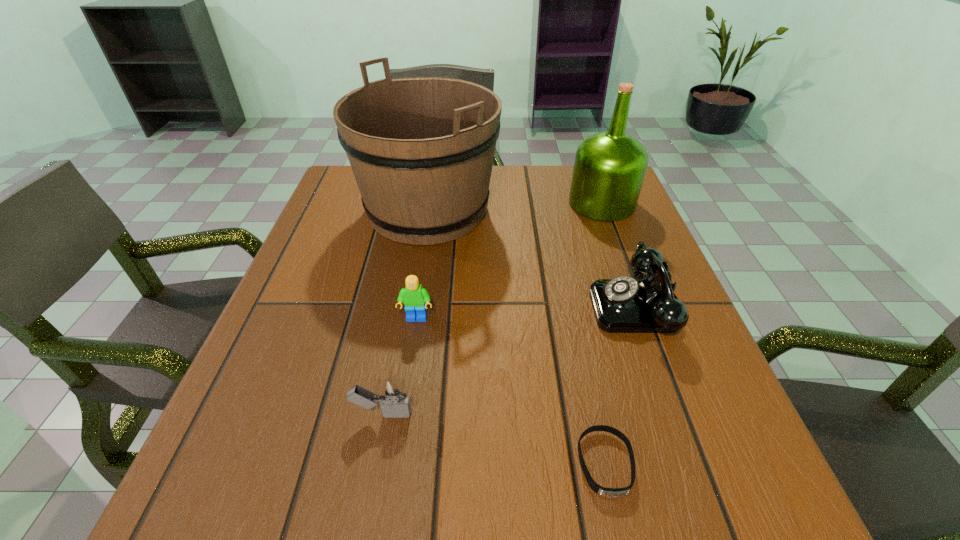
Find the location of `vacant position in the image that satisfies the following two spatial constraints: 1. on the dial of the telephone; 2. on the face of the Lego`. vacant position in the image that satisfies the following two spatial constraints: 1. on the dial of the telephone; 2. on the face of the Lego is located at coordinates (642, 319).

Find the location of a particular element. Image resolution: width=960 pixels, height=540 pixels. vacant space that satisfies the following two spatial constraints: 1. on the dial of the telephone; 2. on the display of the shortest object is located at coordinates (695, 464).

This screenshot has height=540, width=960. I want to click on vacant space that satisfies the following two spatial constraints: 1. on the dial of the telephone; 2. on the face of the Lego, so click(642, 319).

Where is `free region that satisfies the following two spatial constraints: 1. on the back side of the olive oil; 2. on the right side of the bucket`? The height and width of the screenshot is (540, 960). free region that satisfies the following two spatial constraints: 1. on the back side of the olive oil; 2. on the right side of the bucket is located at coordinates (429, 204).